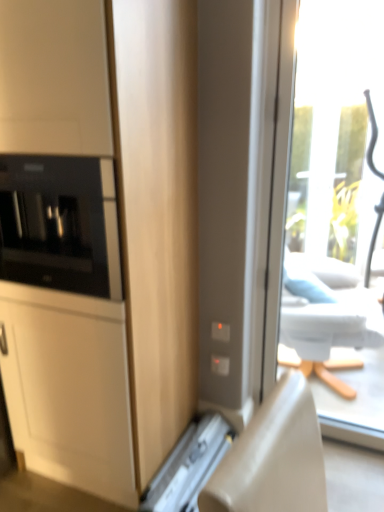
Question: Would you say metallic silver drawer at lower center is part of black glass microwave at left's contents?

Choices:
 (A) no
 (B) yes

Answer: (A)

Question: Is black glass microwave at left positioned beyond the bounds of metallic silver drawer at lower center?

Choices:
 (A) no
 (B) yes

Answer: (B)

Question: Is black glass microwave at left at the left side of metallic silver drawer at lower center?

Choices:
 (A) no
 (B) yes

Answer: (B)

Question: Is black glass microwave at left closer to the viewer compared to metallic silver drawer at lower center?

Choices:
 (A) yes
 (B) no

Answer: (A)

Question: Does black glass microwave at left have a greater width compared to metallic silver drawer at lower center?

Choices:
 (A) yes
 (B) no

Answer: (B)

Question: From the image's perspective, is black glass microwave at left located beneath metallic silver drawer at lower center?

Choices:
 (A) no
 (B) yes

Answer: (A)

Question: From a real-world perspective, is metallic silver drawer at lower center over matte wood cabinet at left?

Choices:
 (A) yes
 (B) no

Answer: (B)

Question: Is metallic silver drawer at lower center with matte wood cabinet at left?

Choices:
 (A) yes
 (B) no

Answer: (B)

Question: Is metallic silver drawer at lower center further to the viewer compared to matte wood cabinet at left?

Choices:
 (A) yes
 (B) no

Answer: (A)

Question: Can you confirm if metallic silver drawer at lower center is smaller than matte wood cabinet at left?

Choices:
 (A) no
 (B) yes

Answer: (B)

Question: From the image's perspective, is metallic silver drawer at lower center on matte wood cabinet at left?

Choices:
 (A) yes
 (B) no

Answer: (B)

Question: Considering the relative sizes of metallic silver drawer at lower center and matte wood cabinet at left in the image provided, is metallic silver drawer at lower center wider than matte wood cabinet at left?

Choices:
 (A) yes
 (B) no

Answer: (A)

Question: Is metallic silver drawer at lower center taller than black glass microwave at left?

Choices:
 (A) no
 (B) yes

Answer: (A)